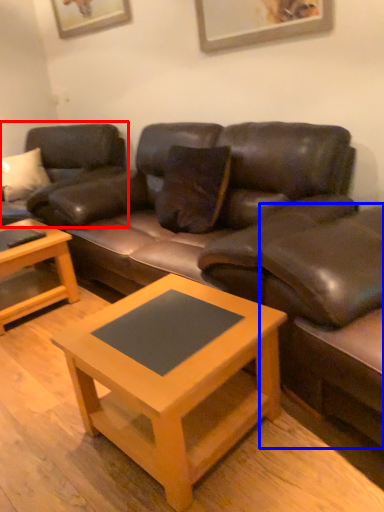
Question: Which of the following is the farthest to the observer, studio couch (highlighted by a red box) or swivel chair (highlighted by a blue box)?

Choices:
 (A) studio couch
 (B) swivel chair

Answer: (A)